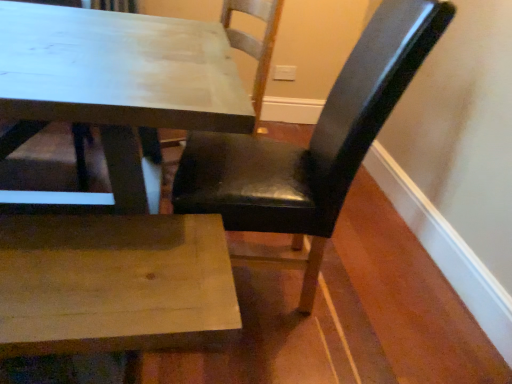
Question: Looking at the image, does black leather chair at center, the second chair in the left-to-right sequence, seem bigger or smaller compared to black leather chair at upper right, the second chair in the right-to-left sequence?

Choices:
 (A) big
 (B) small

Answer: (B)

Question: In terms of width, does black leather chair at center, the second chair in the left-to-right sequence, look wider or thinner when compared to black leather chair at upper right, which is counted as the first chair, starting from the left?

Choices:
 (A) thin
 (B) wide

Answer: (A)

Question: Is black leather chair at center, the 1th chair viewed from the right, taller or shorter than black leather chair at upper right, the second chair in the right-to-left sequence?

Choices:
 (A) short
 (B) tall

Answer: (B)

Question: Is black leather chair at upper right, which is counted as the first chair, starting from the left, inside the boundaries of black leather chair at center, the 1th chair viewed from the right, or outside?

Choices:
 (A) inside
 (B) outside

Answer: (B)

Question: From a real-world perspective, is black leather chair at upper right, which is counted as the first chair, starting from the left, positioned above or below black leather chair at center, the 1th chair viewed from the right?

Choices:
 (A) above
 (B) below

Answer: (B)

Question: Considering their positions, is black leather chair at upper right, the second chair in the right-to-left sequence, located in front of or behind black leather chair at center, the second chair in the left-to-right sequence?

Choices:
 (A) front
 (B) behind

Answer: (B)

Question: In terms of size, does black leather chair at upper right, the second chair in the right-to-left sequence, appear bigger or smaller than black leather chair at center, the 1th chair viewed from the right?

Choices:
 (A) small
 (B) big

Answer: (B)